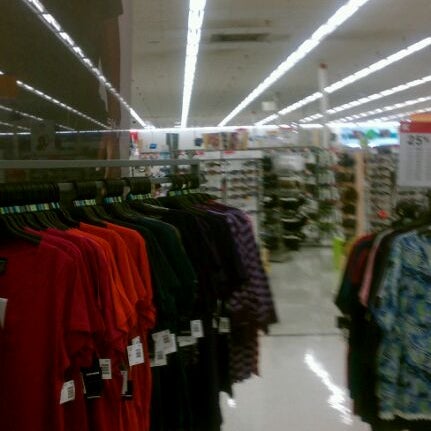
Find the location of a particular element. The height and width of the screenshot is (431, 431). wall is located at coordinates (183, 144).